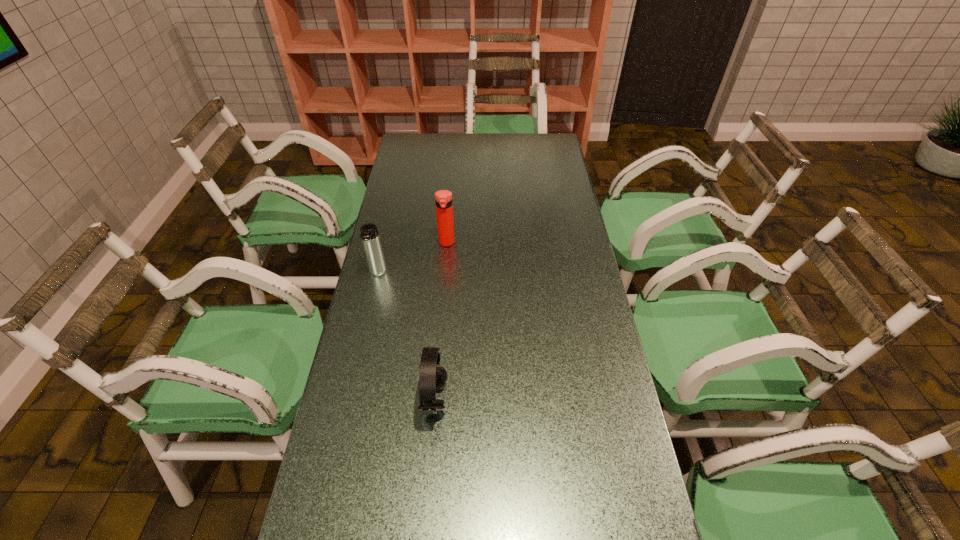
I want to click on the farthest object, so click(x=443, y=198).

Locate an element on the screen. The image size is (960, 540). the right thermos bottle is located at coordinates (443, 198).

Locate an element on the screen. the nearer thermos bottle is located at coordinates (369, 234).

Locate an element on the screen. the left thermos bottle is located at coordinates (369, 234).

The image size is (960, 540). Find the location of `earphone`. earphone is located at coordinates (433, 376).

Where is `free spot located on the back of the farthest object`? This screenshot has height=540, width=960. free spot located on the back of the farthest object is located at coordinates (449, 207).

You are a GUI agent. You are given a task and a screenshot of the screen. Output one action in this format:
    pyautogui.click(x=<x>, y=<y>)
    Task: Click on the free space located on the handle side of the leftmost object
    
    Given the screenshot: What is the action you would take?
    pyautogui.click(x=357, y=364)

Locate an element on the screen. The width and height of the screenshot is (960, 540). vacant area situated on the ear cups of the nearest object is located at coordinates point(509,400).

Image resolution: width=960 pixels, height=540 pixels. In order to click on object that is positioned at the left edge in this screenshot , I will do `click(369, 234)`.

You are a GUI agent. You are given a task and a screenshot of the screen. Output one action in this format:
    pyautogui.click(x=<x>, y=<y>)
    Task: Click on the free space at the far edge of the desktop
    This screenshot has width=960, height=540.
    Given the screenshot: What is the action you would take?
    pyautogui.click(x=471, y=151)